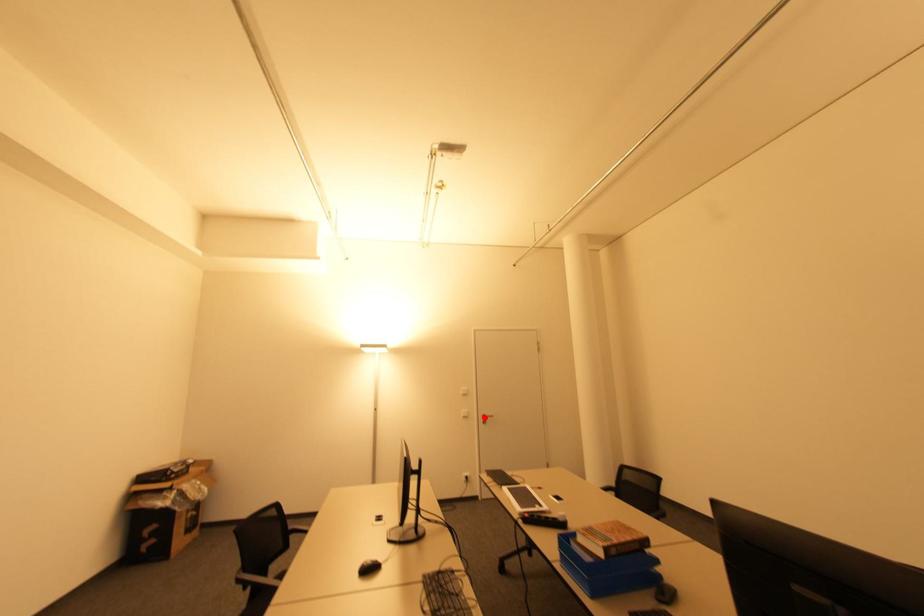
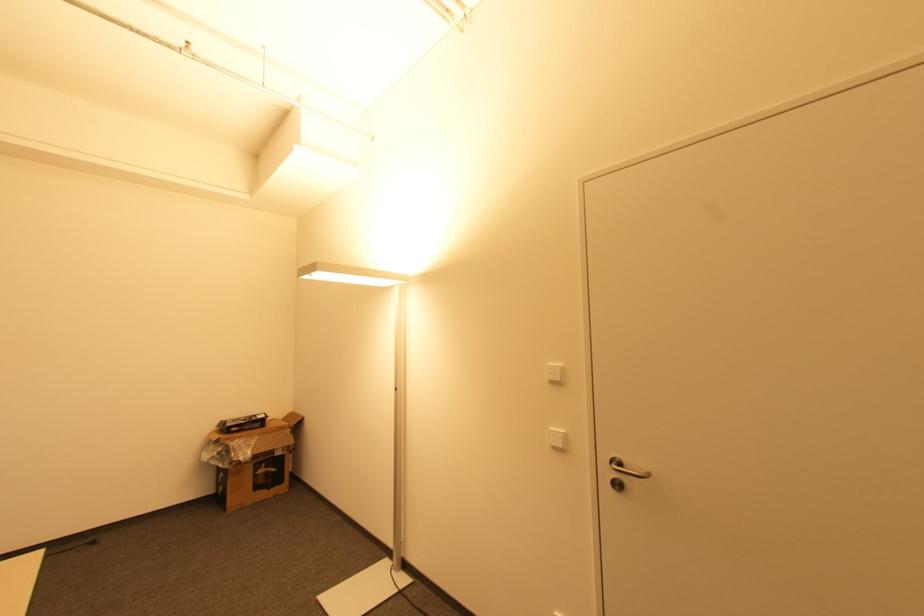
Question: I am providing you with two images of the same scene from different viewpoints. In image1, a red point is highlighted. Considering the same 3D point in image2, which of the following is correct?

Choices:
 (A) It is closer
 (B) It is farther

Answer: (A)